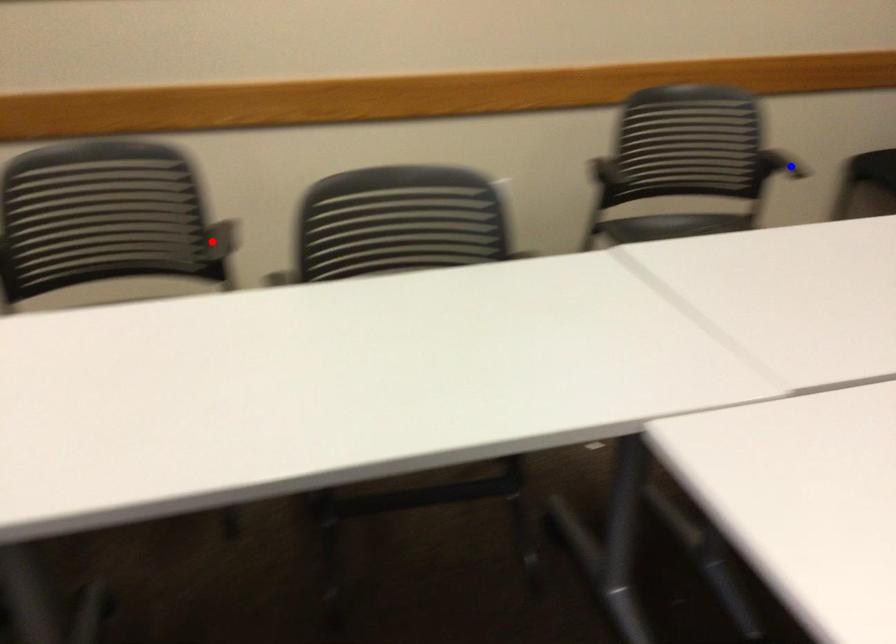
Question: Which of the two points in the image is closer to the camera?

Choices:
 (A) Blue point is closer.
 (B) Red point is closer.

Answer: (B)